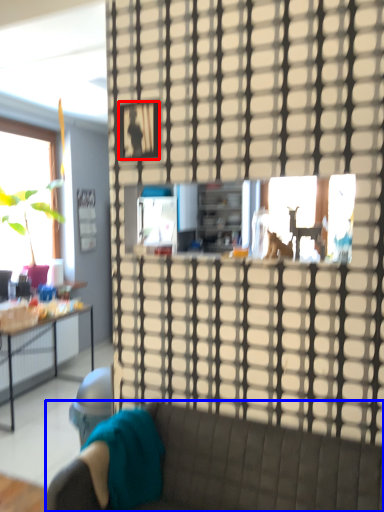
Question: Which point is closer to the camera, picture frame (highlighted by a red box) or studio couch (highlighted by a blue box)?

Choices:
 (A) picture frame
 (B) studio couch

Answer: (B)